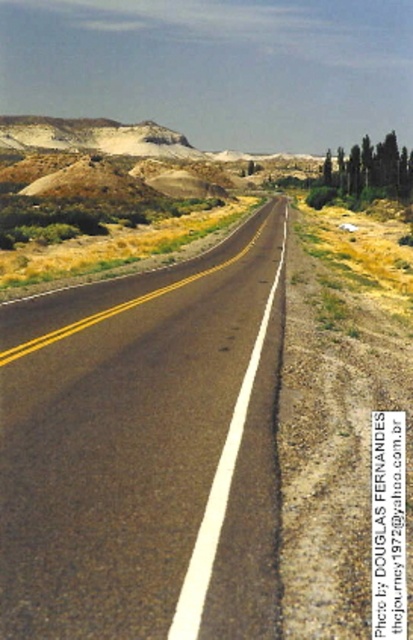
You are a driver approaching a long, straight road with a black asphalt road at center and green textured cypress trees at right. Based on the scene, which object takes up more space in the image?

The green textured cypress trees at right occupy more space than the black asphalt road at center in the image.

You are a driver navigating a semi desert area. You see the black asphalt road at center. Where is the road located in the image?

The black asphalt road at center is located at point [146,451] in the image.